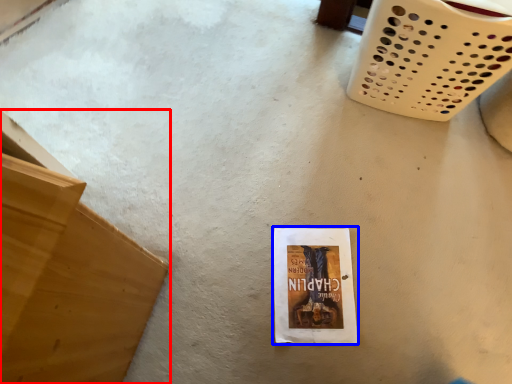
Question: Which object is further to the camera taking this photo, furniture (highlighted by a red box) or paperback book (highlighted by a blue box)?

Choices:
 (A) furniture
 (B) paperback book

Answer: (B)